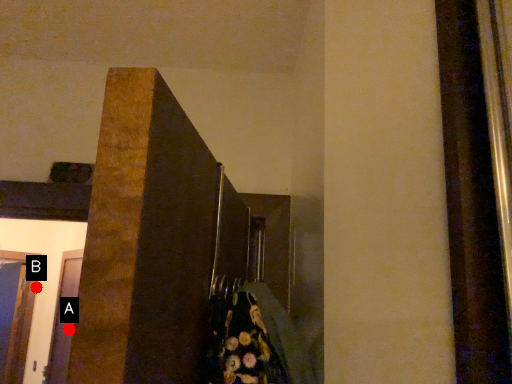
Question: Two points are circled on the image, labeled by A and B beside each circle. Which point is closer to the camera?

Choices:
 (A) A is closer
 (B) B is closer

Answer: (A)